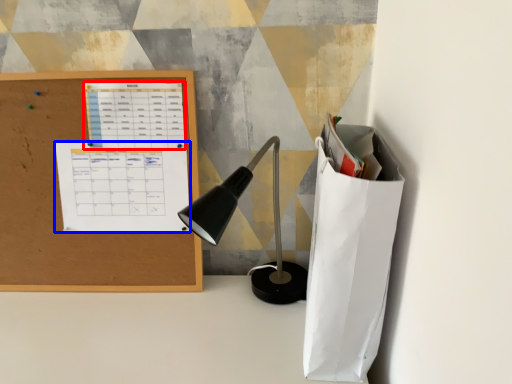
Question: Which point is further to the camera, notebook (highlighted by a red box) or notebook (highlighted by a blue box)?

Choices:
 (A) notebook
 (B) notebook

Answer: (B)